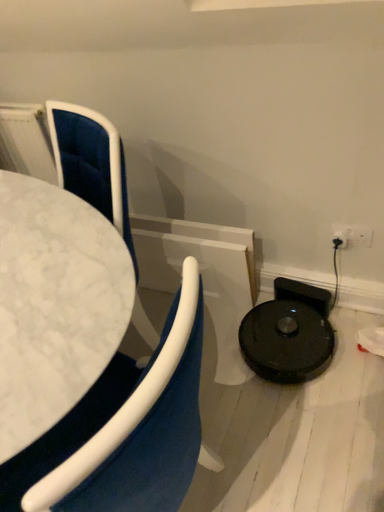
What is the approximate height of velvet blue chair at left, positioned as the first chair in left-to-right order?

It is 29.42 inches.

At what (x,y) coordinates should I click in order to perform the action: click on velvet blue chair at left, acting as the 2th chair starting from the right. Please return your answer as a coordinate pair (x, y). Looking at the image, I should click on (124, 430).

Describe the element at coordinates (124, 430) in the screenshot. The height and width of the screenshot is (512, 384). I see `velvet blue chair at left, positioned as the first chair in left-to-right order` at that location.

Measure the distance between point (71, 173) and camera.

They are 4.75 feet apart.

How much space does velvet blue chair at left, positioned as the first chair in right-to-left order, occupy horizontally?

velvet blue chair at left, positioned as the first chair in right-to-left order, is 14.98 inches wide.

This screenshot has height=512, width=384. Identify the location of velvet blue chair at left, positioned as the first chair in right-to-left order. (91, 163).

The height and width of the screenshot is (512, 384). What do you see at coordinates (91, 163) in the screenshot? I see `velvet blue chair at left, which ranks as the 2th chair in left-to-right order` at bounding box center [91, 163].

This screenshot has width=384, height=512. Find the location of `velvet blue chair at left, positioned as the first chair in left-to-right order`. velvet blue chair at left, positioned as the first chair in left-to-right order is located at coordinates (124, 430).

Which object is positioned more to the right, velvet blue chair at left, positioned as the first chair in right-to-left order, or velvet blue chair at left, positioned as the first chair in left-to-right order?

From the viewer's perspective, velvet blue chair at left, positioned as the first chair in right-to-left order, appears more on the right side.

Between velvet blue chair at left, positioned as the first chair in right-to-left order, and velvet blue chair at left, positioned as the first chair in left-to-right order, which one is positioned in front?

velvet blue chair at left, positioned as the first chair in left-to-right order, is in front.

Between point (115, 147) and point (41, 442), which one is positioned in front?

The point (41, 442) is more forward.

From the image's perspective, which one is positioned higher, velvet blue chair at left, which ranks as the 2th chair in left-to-right order, or velvet blue chair at left, positioned as the first chair in left-to-right order?

From the image's view, velvet blue chair at left, which ranks as the 2th chair in left-to-right order, is above.

Consider the image. From a real-world perspective, is velvet blue chair at left, positioned as the first chair in right-to-left order, on velvet blue chair at left, acting as the 2th chair starting from the right?

Yes, from a real-world perspective, velvet blue chair at left, positioned as the first chair in right-to-left order, is on top of velvet blue chair at left, acting as the 2th chair starting from the right.

Which of these two, velvet blue chair at left, which ranks as the 2th chair in left-to-right order, or velvet blue chair at left, acting as the 2th chair starting from the right, is thinner?

velvet blue chair at left, which ranks as the 2th chair in left-to-right order.

Which of these two, velvet blue chair at left, positioned as the first chair in right-to-left order, or velvet blue chair at left, acting as the 2th chair starting from the right, stands taller?

velvet blue chair at left, acting as the 2th chair starting from the right, is taller.

Considering the relative sizes of velvet blue chair at left, positioned as the first chair in right-to-left order, and velvet blue chair at left, acting as the 2th chair starting from the right, in the image provided, is velvet blue chair at left, positioned as the first chair in right-to-left order, bigger than velvet blue chair at left, acting as the 2th chair starting from the right,?

Incorrect, velvet blue chair at left, positioned as the first chair in right-to-left order, is not larger than velvet blue chair at left, acting as the 2th chair starting from the right.

Would you say velvet blue chair at left, which ranks as the 2th chair in left-to-right order, is outside velvet blue chair at left, positioned as the first chair in left-to-right order?

No, velvet blue chair at left, which ranks as the 2th chair in left-to-right order, is inside velvet blue chair at left, positioned as the first chair in left-to-right order,'s boundary.

Is there a large distance between velvet blue chair at left, which ranks as the 2th chair in left-to-right order, and velvet blue chair at left, acting as the 2th chair starting from the right?

No, velvet blue chair at left, which ranks as the 2th chair in left-to-right order, is not far away from velvet blue chair at left, acting as the 2th chair starting from the right.

Is velvet blue chair at left, which ranks as the 2th chair in left-to-right order, positioned with its back to velvet blue chair at left, acting as the 2th chair starting from the right?

Yes, velvet blue chair at left, which ranks as the 2th chair in left-to-right order, is facing away from velvet blue chair at left, acting as the 2th chair starting from the right.

How different are the orientations of velvet blue chair at left, which ranks as the 2th chair in left-to-right order, and velvet blue chair at left, positioned as the first chair in left-to-right order, in degrees?

The angular difference between velvet blue chair at left, which ranks as the 2th chair in left-to-right order, and velvet blue chair at left, positioned as the first chair in left-to-right order, is 123 degrees.

Find the location of a particular element. Image resolution: width=384 pixels, height=512 pixels. chair that appears on the right of velvet blue chair at left, positioned as the first chair in left-to-right order is located at coordinates (91, 163).

Considering the relative positions of velvet blue chair at left, acting as the 2th chair starting from the right, and velvet blue chair at left, which ranks as the 2th chair in left-to-right order, in the image provided, is velvet blue chair at left, acting as the 2th chair starting from the right, to the left of velvet blue chair at left, which ranks as the 2th chair in left-to-right order, from the viewer's perspective?

Yes.

Is velvet blue chair at left, positioned as the first chair in left-to-right order, in front of or behind velvet blue chair at left, positioned as the first chair in right-to-left order, in the image?

In the image, velvet blue chair at left, positioned as the first chair in left-to-right order, appears in front of velvet blue chair at left, positioned as the first chair in right-to-left order.

Is point (88, 468) closer to camera compared to point (62, 185)?

Yes.

Based on the photo, from the image's perspective, is velvet blue chair at left, positioned as the first chair in left-to-right order, positioned above or below velvet blue chair at left, positioned as the first chair in right-to-left order?

velvet blue chair at left, positioned as the first chair in left-to-right order, is below velvet blue chair at left, positioned as the first chair in right-to-left order.

From a real-world perspective, is velvet blue chair at left, acting as the 2th chair starting from the right, over velvet blue chair at left, positioned as the first chair in right-to-left order?

No, from a real-world perspective, velvet blue chair at left, acting as the 2th chair starting from the right, is not above velvet blue chair at left, positioned as the first chair in right-to-left order.

Can you confirm if velvet blue chair at left, positioned as the first chair in left-to-right order, is wider than velvet blue chair at left, positioned as the first chair in right-to-left order?

Indeed, velvet blue chair at left, positioned as the first chair in left-to-right order, has a greater width compared to velvet blue chair at left, positioned as the first chair in right-to-left order.

Who is shorter, velvet blue chair at left, acting as the 2th chair starting from the right, or velvet blue chair at left, positioned as the first chair in right-to-left order?

velvet blue chair at left, positioned as the first chair in right-to-left order, is shorter.

Considering the relative sizes of velvet blue chair at left, acting as the 2th chair starting from the right, and velvet blue chair at left, positioned as the first chair in right-to-left order, in the image provided, is velvet blue chair at left, acting as the 2th chair starting from the right, bigger than velvet blue chair at left, positioned as the first chair in right-to-left order,?

Correct, velvet blue chair at left, acting as the 2th chair starting from the right, is larger in size than velvet blue chair at left, positioned as the first chair in right-to-left order.

Is velvet blue chair at left, positioned as the first chair in left-to-right order, surrounding velvet blue chair at left, which ranks as the 2th chair in left-to-right order?

Yes, velvet blue chair at left, positioned as the first chair in left-to-right order, is surrounding velvet blue chair at left, which ranks as the 2th chair in left-to-right order.

Is velvet blue chair at left, positioned as the first chair in left-to-right order, positioned far away from velvet blue chair at left, positioned as the first chair in right-to-left order?

velvet blue chair at left, positioned as the first chair in left-to-right order, is near velvet blue chair at left, positioned as the first chair in right-to-left order, not far away.

Could you tell me if velvet blue chair at left, positioned as the first chair in left-to-right order, is facing velvet blue chair at left, which ranks as the 2th chair in left-to-right order?

Yes.

What's the angular difference between velvet blue chair at left, positioned as the first chair in left-to-right order, and velvet blue chair at left, which ranks as the 2th chair in left-to-right order,'s facing directions?

The angle between the facing direction of velvet blue chair at left, positioned as the first chair in left-to-right order, and the facing direction of velvet blue chair at left, which ranks as the 2th chair in left-to-right order, is 123 degrees.

Based on the photo, could you measure the distance between velvet blue chair at left, positioned as the first chair in left-to-right order, and velvet blue chair at left, positioned as the first chair in right-to-left order?

The distance of velvet blue chair at left, positioned as the first chair in left-to-right order, from velvet blue chair at left, positioned as the first chair in right-to-left order, is 24.40 inches.

This screenshot has height=512, width=384. What are the coordinates of `chair in front of the velvet blue chair at left, which ranks as the 2th chair in left-to-right order` in the screenshot? It's located at (124, 430).

This screenshot has height=512, width=384. In order to click on chair beneath the velvet blue chair at left, which ranks as the 2th chair in left-to-right order (from a real-world perspective) in this screenshot , I will do `click(124, 430)`.

Where is `chair above the velvet blue chair at left, positioned as the first chair in left-to-right order (from the image's perspective)`? This screenshot has height=512, width=384. chair above the velvet blue chair at left, positioned as the first chair in left-to-right order (from the image's perspective) is located at coordinates (91, 163).